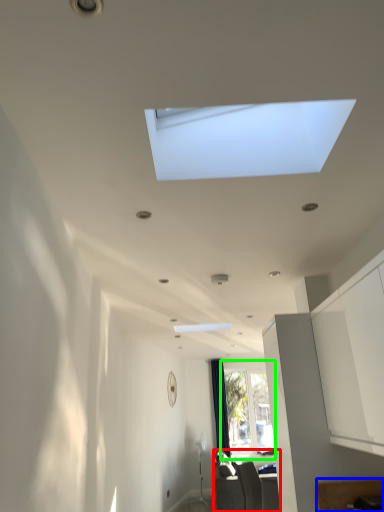
Question: Based on their relative distances, which object is farther from furniture (highlighted by a red box)? Choose from furniture (highlighted by a blue box) and window (highlighted by a green box).

Choices:
 (A) furniture
 (B) window

Answer: (A)